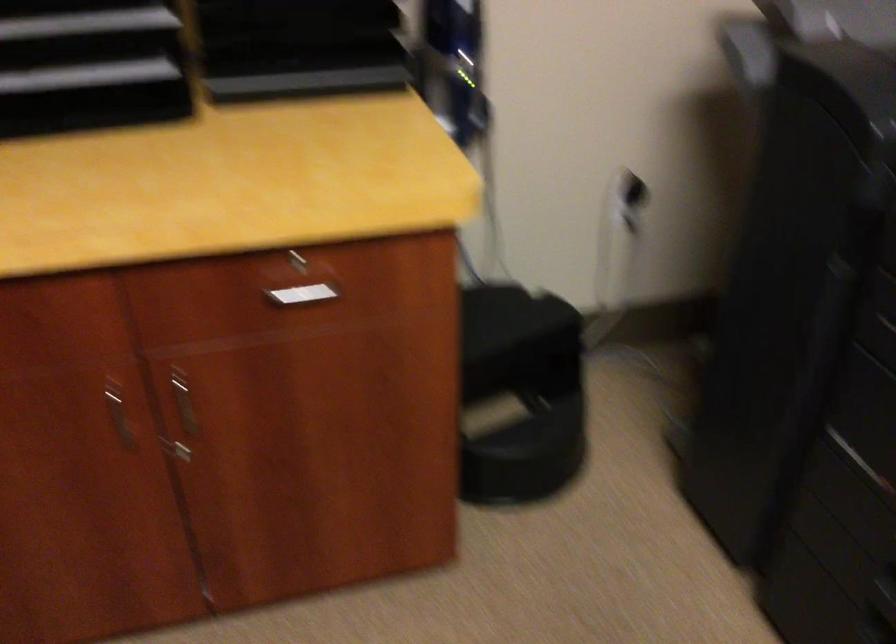
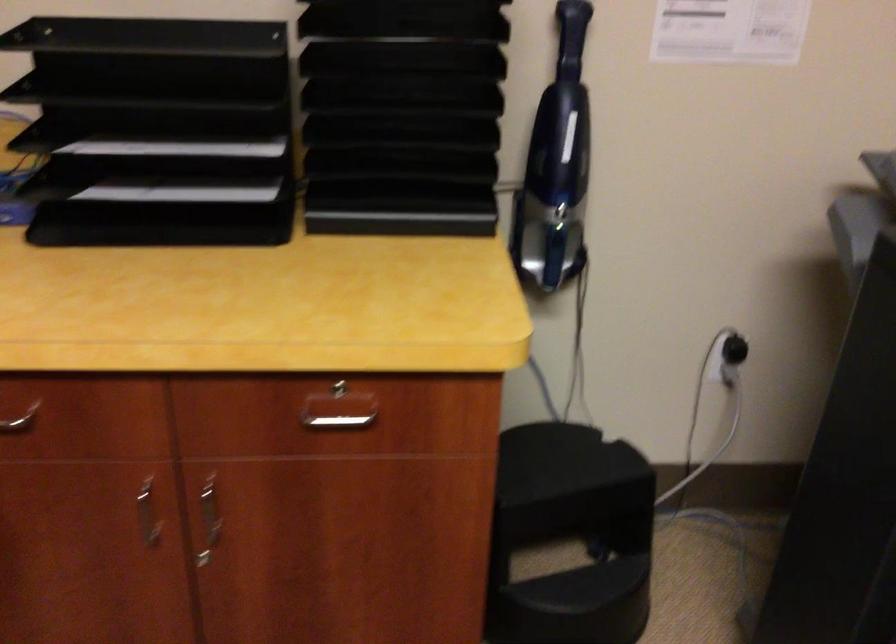
In the second image, find the point that corresponds to point 500,389 in the first image.

(571, 536)